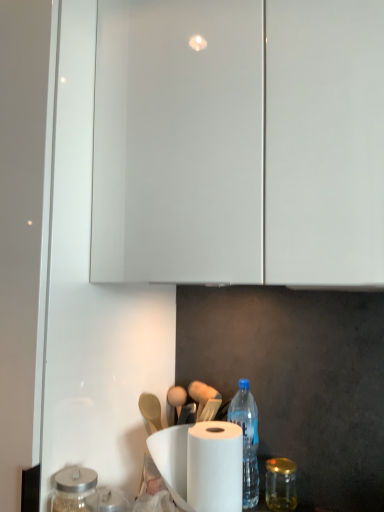
Measure the distance between gold metallic jar at lower right, which appears as the second glass jar when viewed from the front, and camera.

The depth of gold metallic jar at lower right, which appears as the second glass jar when viewed from the front, is 3.94 feet.

Describe the element at coordinates (247, 440) in the screenshot. I see `blue plastic bottle at lower center` at that location.

Locate an element on the screen. The image size is (384, 512). gold metallic jar at lower right, which ranks as the first glass jar in right-to-left order is located at coordinates coord(280,484).

From their relative heights in the image, would you say blue plastic bottle at lower center is taller or shorter than transparent glass jar at lower left, arranged as the 2th glass jar when viewed from the right?

Considering their sizes, blue plastic bottle at lower center has more height than transparent glass jar at lower left, arranged as the 2th glass jar when viewed from the right.

Is blue plastic bottle at lower center turned away from transparent glass jar at lower left, the first glass jar in the front-to-back sequence?

No, transparent glass jar at lower left, the first glass jar in the front-to-back sequence, is not at the back of blue plastic bottle at lower center.

Image resolution: width=384 pixels, height=512 pixels. I want to click on bottle above the transparent glass jar at lower left, which ranks as the second glass jar in back-to-front order (from the image's perspective), so click(x=247, y=440).

How many degrees apart are the facing directions of blue plastic bottle at lower center and transparent glass jar at lower left, marked as the first glass jar in a left-to-right arrangement?

The angular difference between blue plastic bottle at lower center and transparent glass jar at lower left, marked as the first glass jar in a left-to-right arrangement, is 1.75 degrees.

What's the angular difference between gold metallic jar at lower right, which appears as the second glass jar when viewed from the front, and transparent glass jar at lower left, arranged as the 2th glass jar when viewed from the right,'s facing directions?

The angular difference between gold metallic jar at lower right, which appears as the second glass jar when viewed from the front, and transparent glass jar at lower left, arranged as the 2th glass jar when viewed from the right, is 8.64 degrees.

Does gold metallic jar at lower right, which ranks as the first glass jar in right-to-left order, appear on the left side of transparent glass jar at lower left, which ranks as the second glass jar in back-to-front order?

In fact, gold metallic jar at lower right, which ranks as the first glass jar in right-to-left order, is to the right of transparent glass jar at lower left, which ranks as the second glass jar in back-to-front order.

From a real-world perspective, is gold metallic jar at lower right, positioned as the 2th glass jar in left-to-right order, over transparent glass jar at lower left, the first glass jar in the front-to-back sequence?

Incorrect, from a real-world perspective, gold metallic jar at lower right, positioned as the 2th glass jar in left-to-right order, is lower than transparent glass jar at lower left, the first glass jar in the front-to-back sequence.

From the image's perspective, which one is positioned higher, gold metallic jar at lower right, positioned as the 2th glass jar in left-to-right order, or transparent glass jar at lower left, which ranks as the second glass jar in back-to-front order?

From the image's view, transparent glass jar at lower left, which ranks as the second glass jar in back-to-front order, is above.

Are gold metallic jar at lower right, which ranks as the first glass jar in right-to-left order, and blue plastic bottle at lower center beside each other?

There is a gap between gold metallic jar at lower right, which ranks as the first glass jar in right-to-left order, and blue plastic bottle at lower center.

Looking at the image, does gold metallic jar at lower right, which ranks as the first glass jar in back-to-front order, seem bigger or smaller compared to blue plastic bottle at lower center?

Clearly, gold metallic jar at lower right, which ranks as the first glass jar in back-to-front order, is smaller in size than blue plastic bottle at lower center.

From a real-world perspective, which is physically below, gold metallic jar at lower right, which ranks as the first glass jar in right-to-left order, or blue plastic bottle at lower center?

gold metallic jar at lower right, which ranks as the first glass jar in right-to-left order.

Is transparent glass jar at lower left, arranged as the 2th glass jar when viewed from the right, at the left side of gold metallic jar at lower right, which appears as the second glass jar when viewed from the front?

Yes.

Which of these two, transparent glass jar at lower left, which ranks as the second glass jar in back-to-front order, or gold metallic jar at lower right, which ranks as the first glass jar in right-to-left order, is thinner?

gold metallic jar at lower right, which ranks as the first glass jar in right-to-left order.

Does transparent glass jar at lower left, marked as the first glass jar in a left-to-right arrangement, turn towards gold metallic jar at lower right, which appears as the second glass jar when viewed from the front?

No, transparent glass jar at lower left, marked as the first glass jar in a left-to-right arrangement, is not turned towards gold metallic jar at lower right, which appears as the second glass jar when viewed from the front.

Is blue plastic bottle at lower center far from gold metallic jar at lower right, which ranks as the first glass jar in right-to-left order?

blue plastic bottle at lower center is actually quite close to gold metallic jar at lower right, which ranks as the first glass jar in right-to-left order.

Considering the sizes of objects blue plastic bottle at lower center and gold metallic jar at lower right, which ranks as the first glass jar in back-to-front order, in the image provided, who is taller, blue plastic bottle at lower center or gold metallic jar at lower right, which ranks as the first glass jar in back-to-front order,?

blue plastic bottle at lower center is taller.

From the image's perspective, is blue plastic bottle at lower center located above or below gold metallic jar at lower right, positioned as the 2th glass jar in left-to-right order?

Clearly, from the image's perspective, blue plastic bottle at lower center is above gold metallic jar at lower right, positioned as the 2th glass jar in left-to-right order.

Is blue plastic bottle at lower center closer to camera compared to gold metallic jar at lower right, positioned as the 2th glass jar in left-to-right order?

No, blue plastic bottle at lower center is further to the viewer.

Is transparent glass jar at lower left, the first glass jar in the front-to-back sequence, at the left side of blue plastic bottle at lower center?

Indeed, transparent glass jar at lower left, the first glass jar in the front-to-back sequence, is positioned on the left side of blue plastic bottle at lower center.

Which is behind, point (78, 481) or point (235, 421)?

The point (235, 421) is more distant.

From the picture: Considering the relative sizes of transparent glass jar at lower left, arranged as the 2th glass jar when viewed from the right, and blue plastic bottle at lower center in the image provided, is transparent glass jar at lower left, arranged as the 2th glass jar when viewed from the right, wider than blue plastic bottle at lower center?

No.

This screenshot has width=384, height=512. In the image, there is a transparent glass jar at lower left, marked as the first glass jar in a left-to-right arrangement. What are the coordinates of `bottle above it (from the image's perspective)` in the screenshot? It's located at (247, 440).

Find the location of a particular element. This screenshot has height=512, width=384. glass jar located underneath the transparent glass jar at lower left, the first glass jar in the front-to-back sequence (from a real-world perspective) is located at coordinates (280, 484).

Estimate the real-world distances between objects in this image. Which object is further from gold metallic jar at lower right, which ranks as the first glass jar in back-to-front order, blue plastic bottle at lower center or transparent glass jar at lower left, marked as the first glass jar in a left-to-right arrangement?

The object further to gold metallic jar at lower right, which ranks as the first glass jar in back-to-front order, is transparent glass jar at lower left, marked as the first glass jar in a left-to-right arrangement.

Which object lies further to the anchor point blue plastic bottle at lower center, gold metallic jar at lower right, which appears as the second glass jar when viewed from the front, or transparent glass jar at lower left, the first glass jar in the front-to-back sequence?

transparent glass jar at lower left, the first glass jar in the front-to-back sequence.

Considering their positions, is transparent glass jar at lower left, the first glass jar in the front-to-back sequence, positioned closer to gold metallic jar at lower right, positioned as the 2th glass jar in left-to-right order, than blue plastic bottle at lower center?

blue plastic bottle at lower center is positioned closer to the anchor gold metallic jar at lower right, positioned as the 2th glass jar in left-to-right order.

When comparing their distances from transparent glass jar at lower left, the first glass jar in the front-to-back sequence, does gold metallic jar at lower right, which appears as the second glass jar when viewed from the front, or blue plastic bottle at lower center seem further?

Among the two, gold metallic jar at lower right, which appears as the second glass jar when viewed from the front, is located further to transparent glass jar at lower left, the first glass jar in the front-to-back sequence.

Looking at the image, which one is located further to blue plastic bottle at lower center, transparent glass jar at lower left, the first glass jar in the front-to-back sequence, or gold metallic jar at lower right, which ranks as the first glass jar in back-to-front order?

transparent glass jar at lower left, the first glass jar in the front-to-back sequence, lies further to blue plastic bottle at lower center than the other object.

Estimate the real-world distances between objects in this image. Which object is further from transparent glass jar at lower left, the first glass jar in the front-to-back sequence, blue plastic bottle at lower center or gold metallic jar at lower right, which ranks as the first glass jar in right-to-left order?

gold metallic jar at lower right, which ranks as the first glass jar in right-to-left order, is positioned further to the anchor transparent glass jar at lower left, the first glass jar in the front-to-back sequence.

Locate an element on the screen. bottle between transparent glass jar at lower left, marked as the first glass jar in a left-to-right arrangement, and gold metallic jar at lower right, which ranks as the first glass jar in right-to-left order, from left to right is located at coordinates (247, 440).